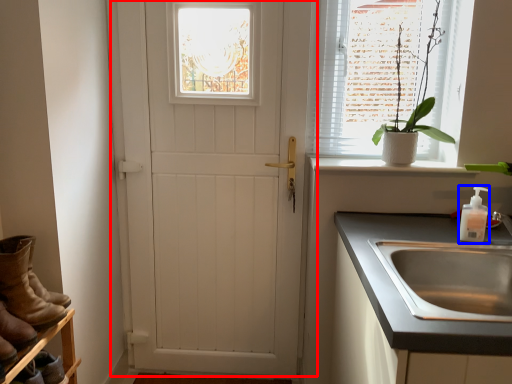
Question: Which of the following is the farthest to the observer, door (highlighted by a red box) or soap dispenser (highlighted by a blue box)?

Choices:
 (A) door
 (B) soap dispenser

Answer: (A)